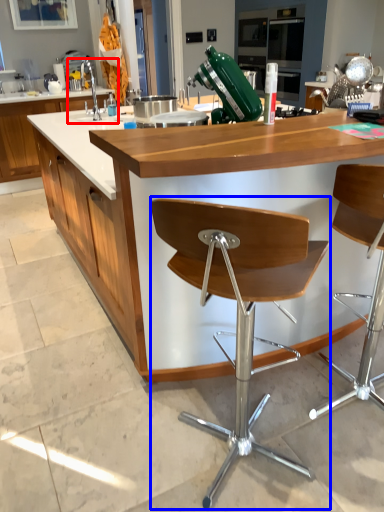
Question: Which object appears farthest to the camera in this image, sink (highlighted by a red box) or chair (highlighted by a blue box)?

Choices:
 (A) sink
 (B) chair

Answer: (A)